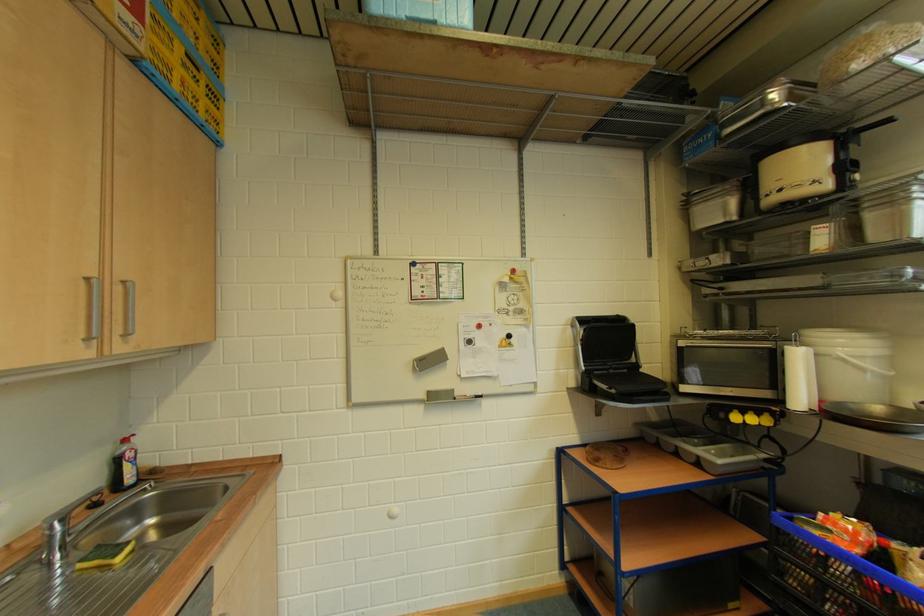
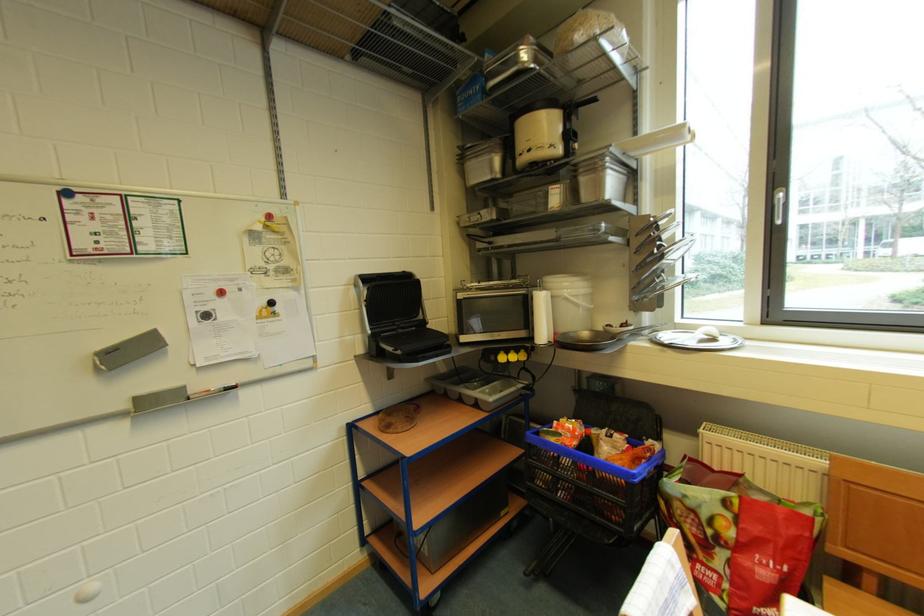
Where in the second image is the point corresponding to the point at 424,371 from the first image?

(110, 370)